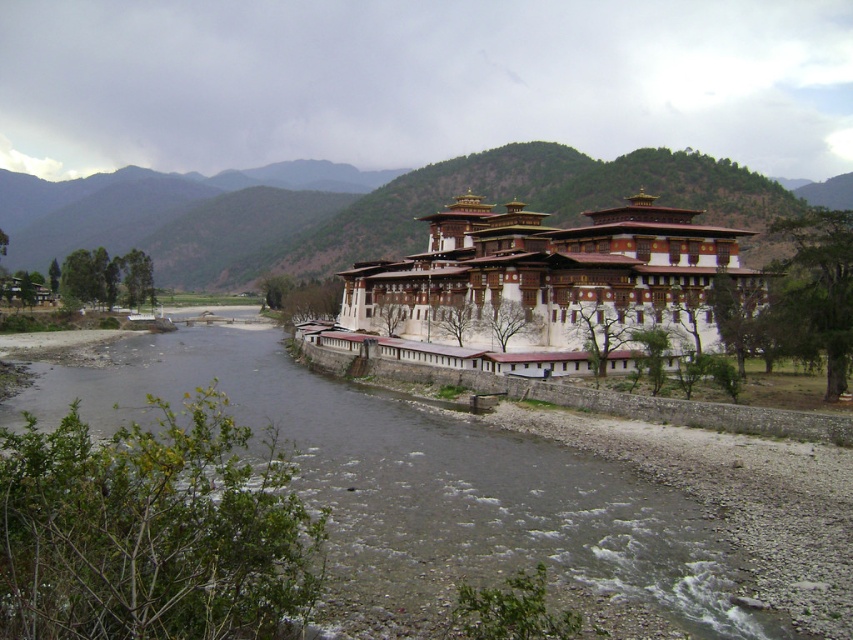
Question: Does brown gravel stream at lower center have a larger size compared to green forested mountain at center?

Choices:
 (A) yes
 (B) no

Answer: (B)

Question: Among these points, which one is farthest from the camera?

Choices:
 (A) (396, 188)
 (B) (529, 301)
 (C) (264, 412)

Answer: (A)

Question: Can you confirm if brown gravel stream at lower center is smaller than green forested mountain at center?

Choices:
 (A) no
 (B) yes

Answer: (B)

Question: Which point is closer to the camera?

Choices:
 (A) brown gravel stream at lower center
 (B) white painted stone building at center

Answer: (A)

Question: Which object appears farthest from the camera in this image?

Choices:
 (A) white painted stone building at center
 (B) green forested mountain at center
 (C) brown gravel stream at lower center

Answer: (B)

Question: Can you confirm if brown gravel stream at lower center is thinner than white painted stone building at center?

Choices:
 (A) yes
 (B) no

Answer: (B)